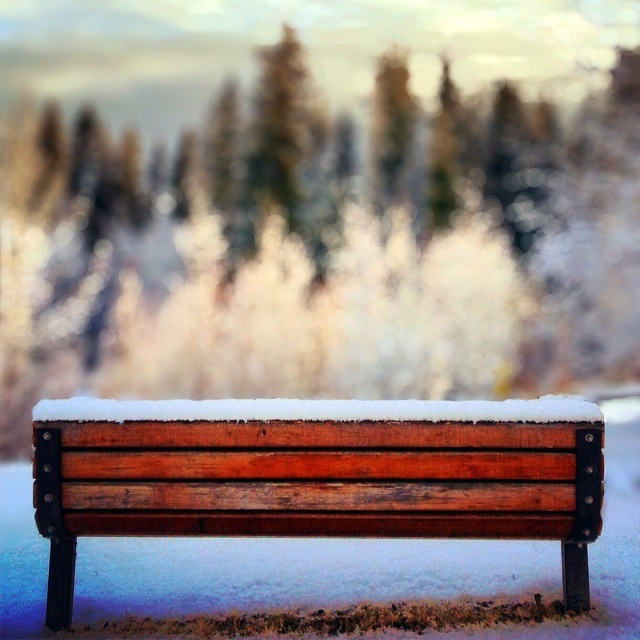
Question: Where is wooden bench at center located in relation to white fluffy snow at center in the image?

Choices:
 (A) above
 (B) below

Answer: (B)

Question: Does wooden bench at center come in front of white fluffy snow at center?

Choices:
 (A) yes
 (B) no

Answer: (B)

Question: Does wooden bench at center have a larger size compared to white fluffy snow at center?

Choices:
 (A) no
 (B) yes

Answer: (B)

Question: Which object appears closest to the camera in this image?

Choices:
 (A) wooden bench at center
 (B) white fluffy snow at center

Answer: (B)

Question: Which point is farther to the camera?

Choices:
 (A) white fluffy snow at center
 (B) wooden bench at center

Answer: (B)

Question: Which object is closer to the camera taking this photo?

Choices:
 (A) white fluffy snow at center
 (B) wooden bench at center

Answer: (A)